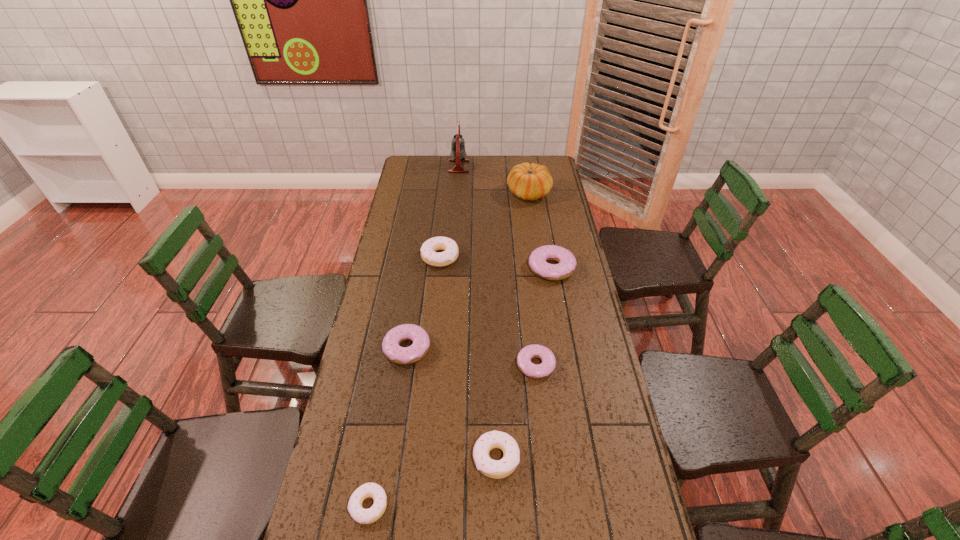
This screenshot has width=960, height=540. I want to click on bell, so click(458, 153).

I want to click on the tallest object, so click(458, 153).

Where is `the second tallest object`? The height and width of the screenshot is (540, 960). the second tallest object is located at coordinates click(529, 182).

Find the location of `gourd`. gourd is located at coordinates (529, 182).

Identify the location of the farthest white doughnut. [x=438, y=259].

At what (x,y) coordinates should I click in order to perform the action: click on the farthest pink doughnut. Please return your answer as a coordinate pair (x, y). The height and width of the screenshot is (540, 960). Looking at the image, I should click on (566, 266).

Identify the location of the second biggest pink doughnut. The height and width of the screenshot is (540, 960). (392, 350).

Locate an element on the screen. the third doughnut from right to left is located at coordinates (496, 469).

Where is `the second biggest white doughnut`? the second biggest white doughnut is located at coordinates (496, 469).

Locate an element on the screen. the smallest pink doughnut is located at coordinates (537, 371).